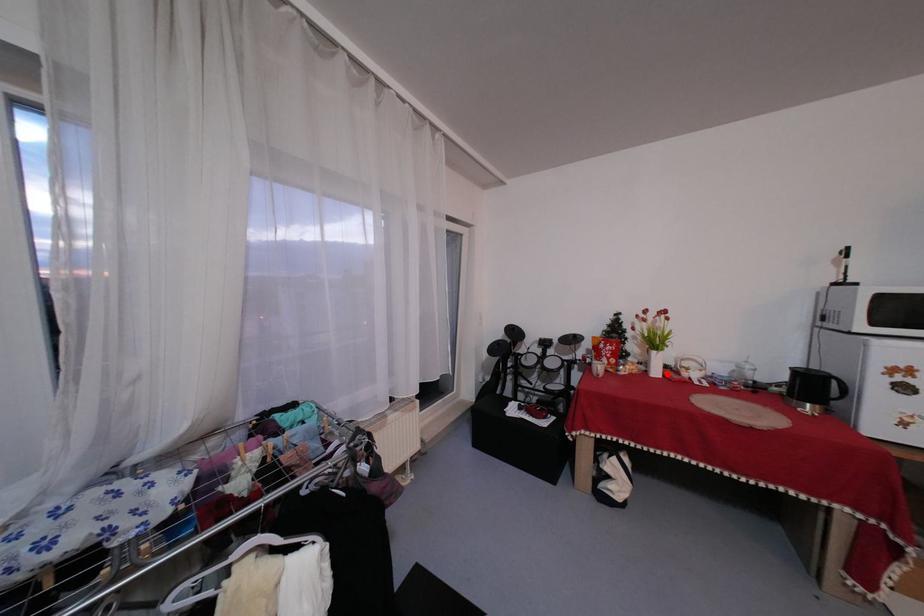
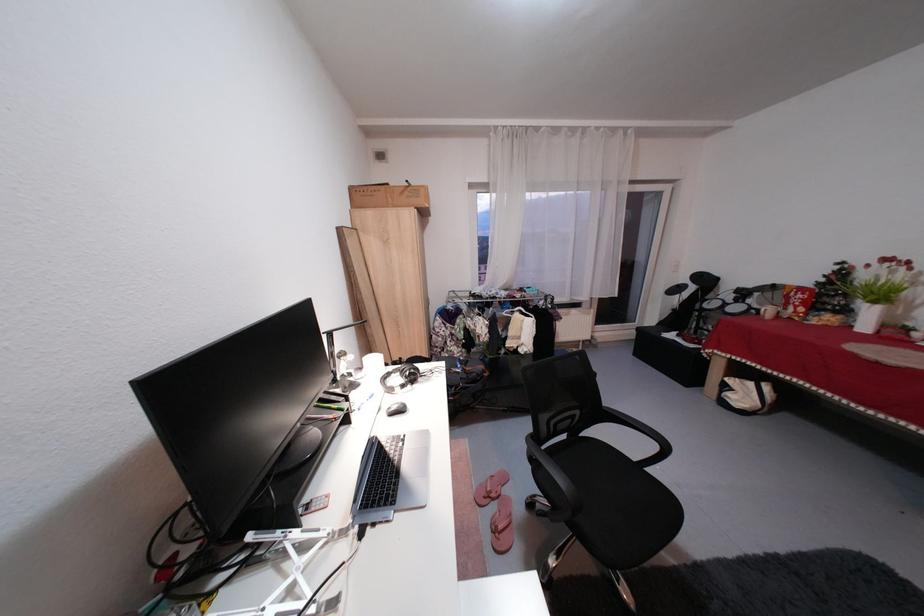
In the second image, find the point that corresponds to the highlighted location in the first image.

(877, 330)